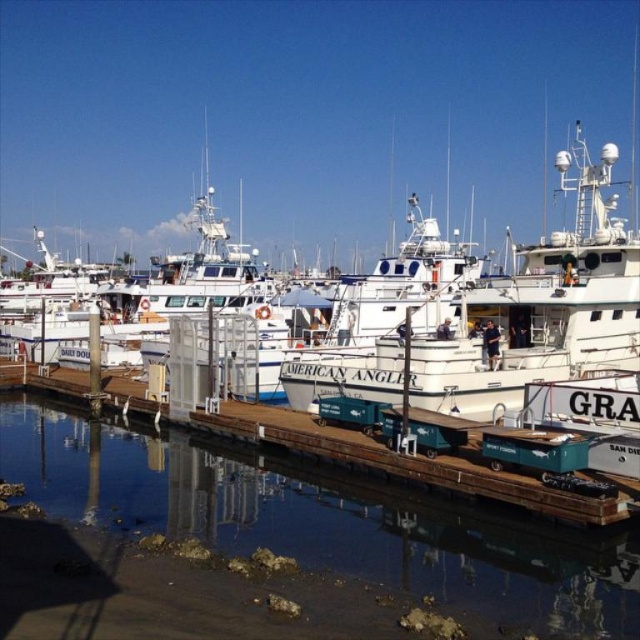
Question: Which point appears closest to the camera in this image?

Choices:
 (A) (595, 349)
 (B) (458, 596)

Answer: (B)

Question: Does clear water at dock center lie behind white matte boat at center?

Choices:
 (A) yes
 (B) no

Answer: (B)

Question: Is clear water at dock center positioned at the back of white matte boat at center?

Choices:
 (A) no
 (B) yes

Answer: (A)

Question: Does clear water at dock center have a larger size compared to white matte boat at center?

Choices:
 (A) yes
 (B) no

Answer: (B)

Question: Which point is closer to the camera taking this photo?

Choices:
 (A) (372, 381)
 (B) (358, 538)

Answer: (B)

Question: Which object appears closest to the camera in this image?

Choices:
 (A) clear water at dock center
 (B) white matte boat at center

Answer: (A)